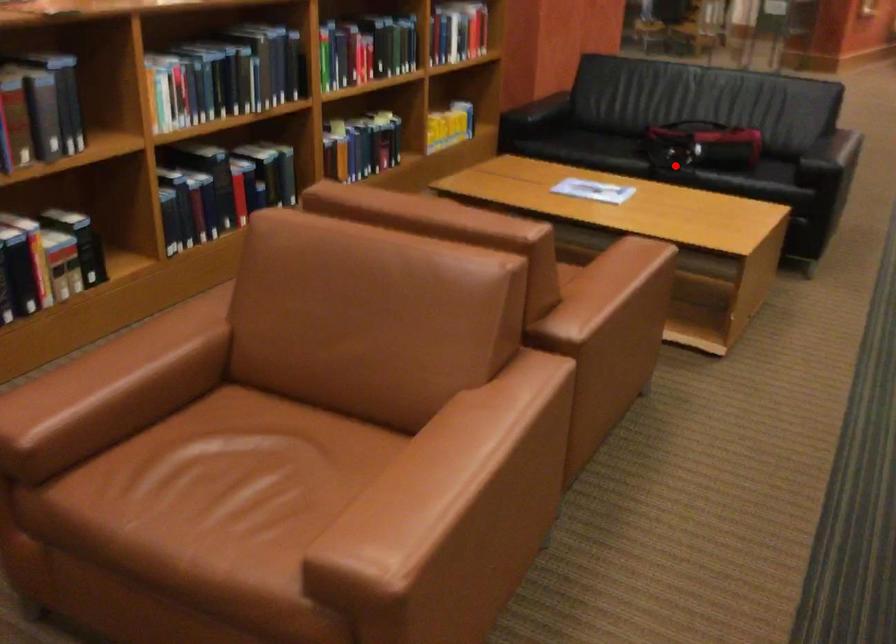
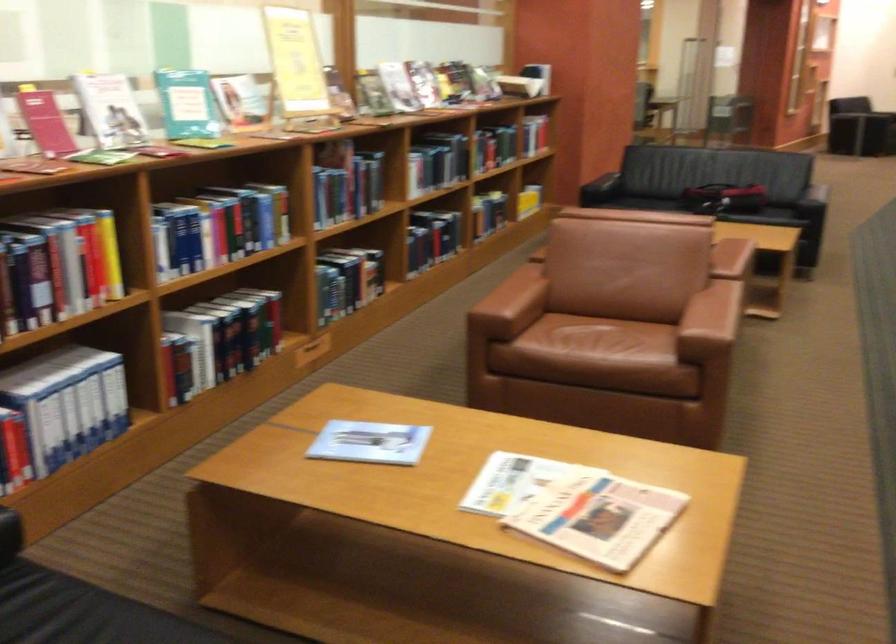
Question: I am providing you with two images of the same scene from different viewpoints. Given a red point in image1, look at the same physical point in image2. Is it:

Choices:
 (A) Closer to the viewpoint
 (B) Farther from the viewpoint

Answer: (B)